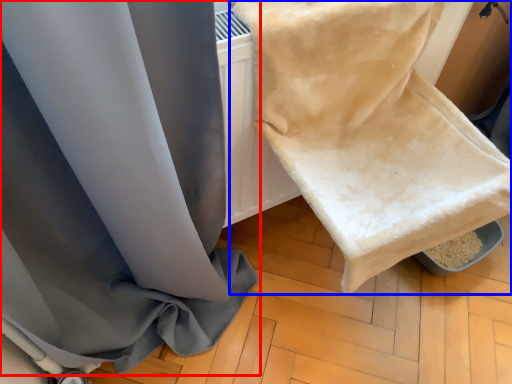
Question: Which of the following is the closest to the observer, curtain (highlighted by a red box) or towel (highlighted by a blue box)?

Choices:
 (A) curtain
 (B) towel

Answer: (A)